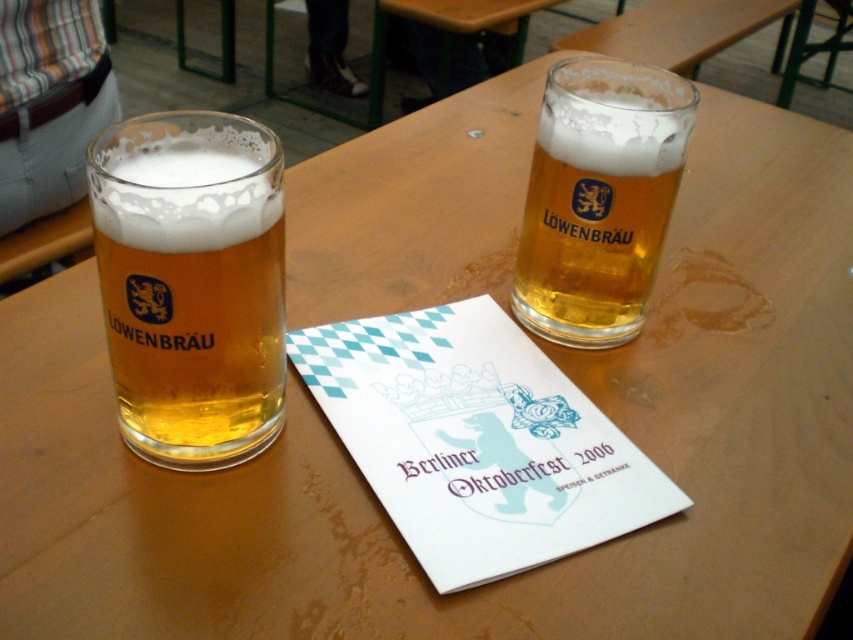
Question: Does translucent glass mug at left appear on the left side of golden glass beer at upper right?

Choices:
 (A) yes
 (B) no

Answer: (A)

Question: Is translucent glass mug at left to the left of golden glass beer at upper right from the viewer's perspective?

Choices:
 (A) no
 (B) yes

Answer: (B)

Question: Which of the following is the farthest from the observer?

Choices:
 (A) (202, 195)
 (B) (689, 106)

Answer: (B)

Question: Among these points, which one is nearest to the camera?

Choices:
 (A) (595, 116)
 (B) (198, 275)

Answer: (B)

Question: Which object appears closest to the camera in this image?

Choices:
 (A) translucent glass mug at left
 (B) golden glass beer at upper right

Answer: (A)

Question: Can you confirm if translucent glass mug at left is wider than golden glass beer at upper right?

Choices:
 (A) yes
 (B) no

Answer: (B)